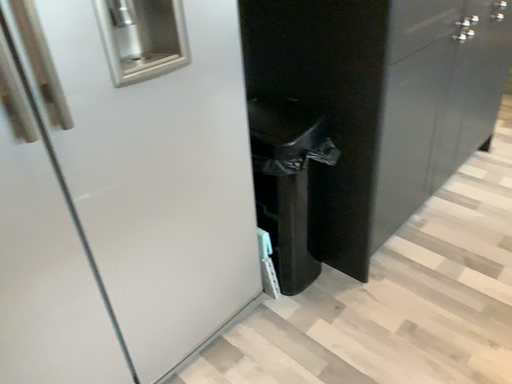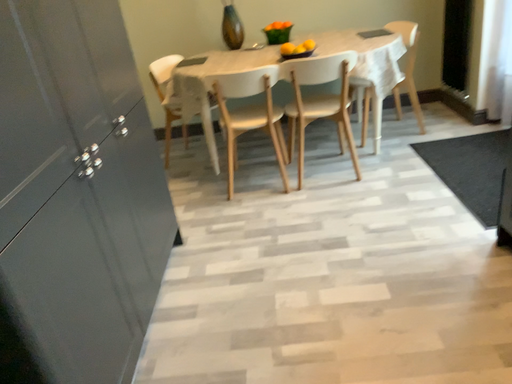
Question: Which way did the camera rotate in the video?

Choices:
 (A) rotated right
 (B) rotated left

Answer: (A)